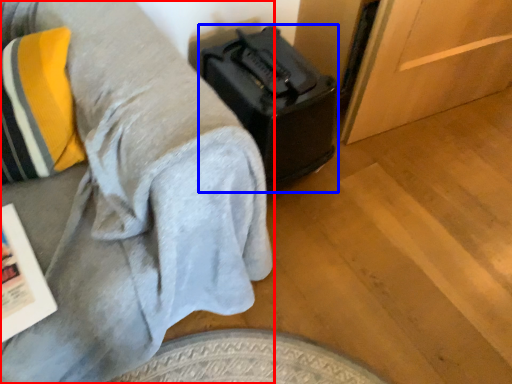
Question: Which point is closer to the camera, furniture (highlighted by a red box) or luggage (highlighted by a blue box)?

Choices:
 (A) furniture
 (B) luggage

Answer: (A)